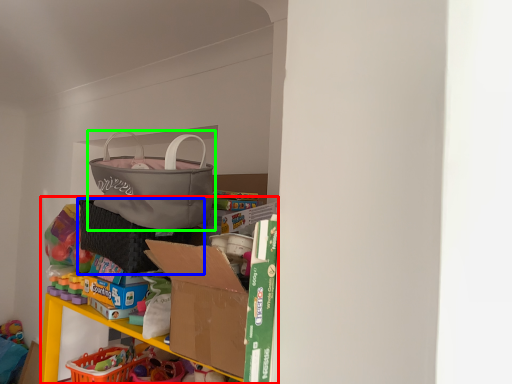
Question: Considering the real-world distances, which object is closest to bookshelf (highlighted by a red box)? laundry basket (highlighted by a blue box) or handbag (highlighted by a green box).

Choices:
 (A) laundry basket
 (B) handbag

Answer: (A)